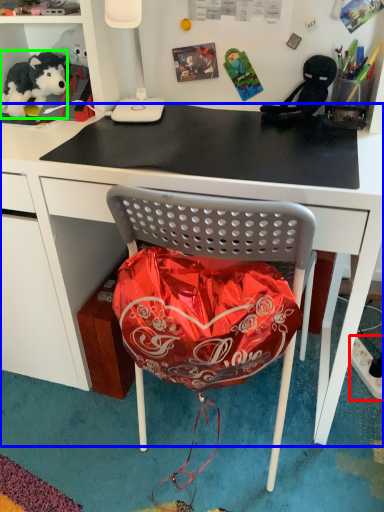
Question: Which object is positioned farthest from power outlet (highlighted by a red box)? Select from desk (highlighted by a blue box) and teddy bear (highlighted by a green box).

Choices:
 (A) desk
 (B) teddy bear

Answer: (B)